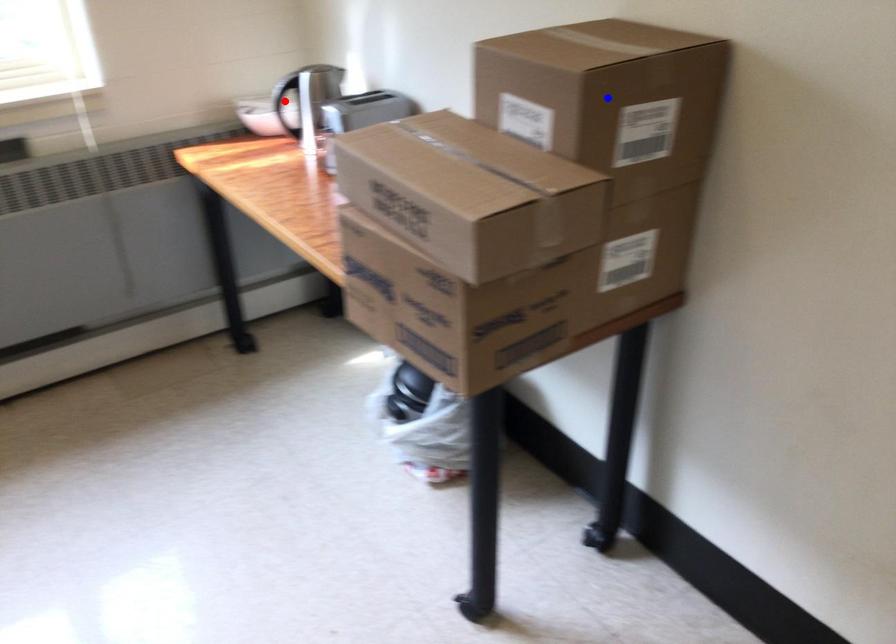
Question: Which of the two points in the image is closer to the camera?

Choices:
 (A) Blue point is closer.
 (B) Red point is closer.

Answer: (A)